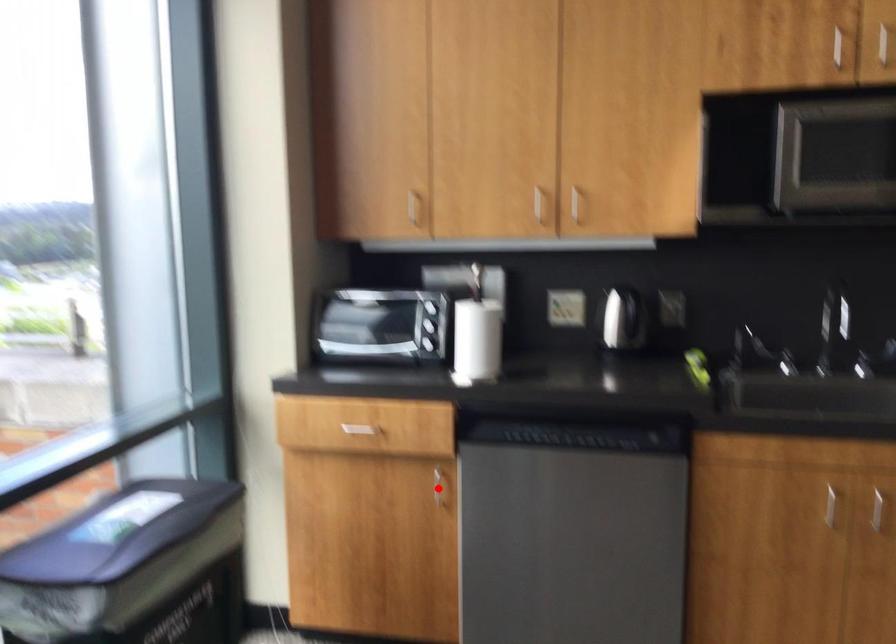
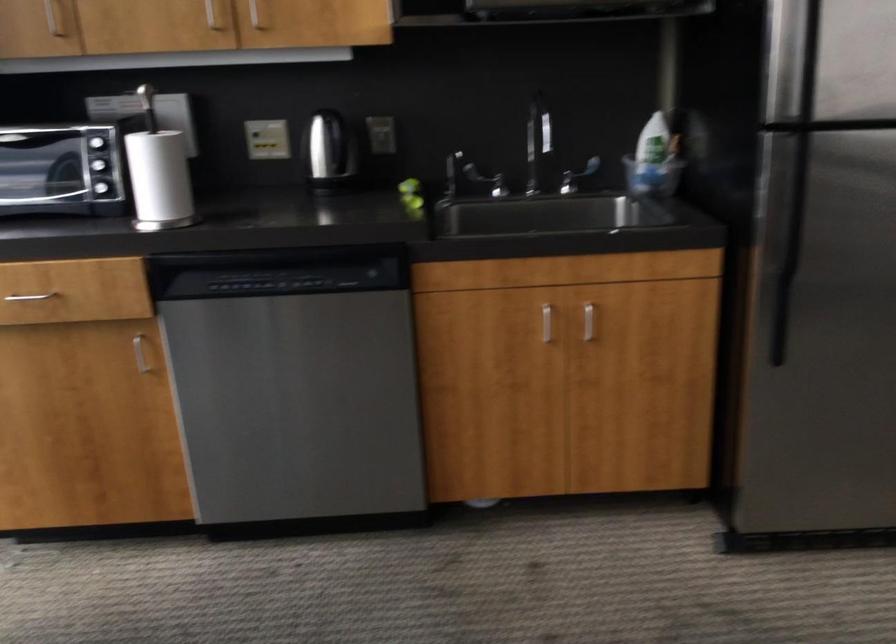
Locate, in the second image, the point that corresponds to the highlighted location in the first image.

(140, 354)